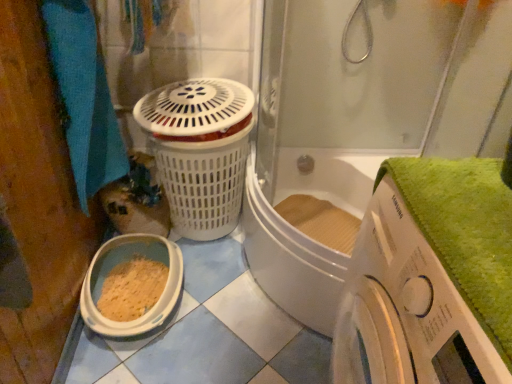
Question: Considering the positions of point (403, 274) and point (343, 64), is point (403, 274) closer or farther from the camera than point (343, 64)?

Choices:
 (A) farther
 (B) closer

Answer: (B)

Question: From the image's perspective, is white plastic washing machine at lower right located above or below transparent glass shower door at upper center?

Choices:
 (A) above
 (B) below

Answer: (B)

Question: Estimate the real-world distances between objects in this image. Which object is closer to the white plastic washing machine at lower right?

Choices:
 (A) blue fabric towel at left
 (B) transparent glass shower door at upper center

Answer: (B)

Question: Estimate the real-world distances between objects in this image. Which object is farther from the white plastic washing machine at lower right?

Choices:
 (A) blue fabric towel at left
 (B) transparent glass shower door at upper center

Answer: (A)